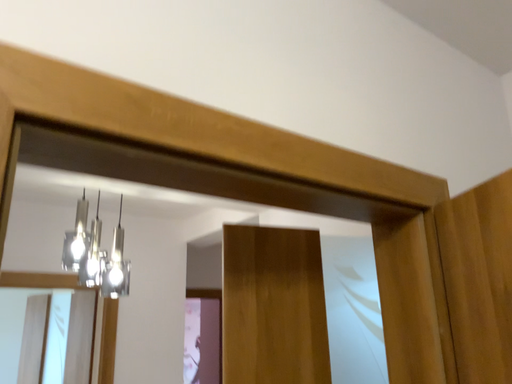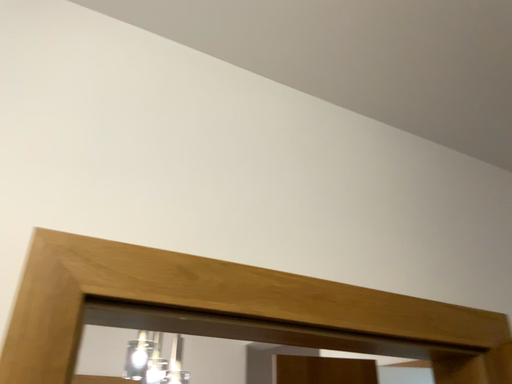
Question: How did the camera likely rotate when shooting the video?

Choices:
 (A) rotated left
 (B) rotated right

Answer: (A)